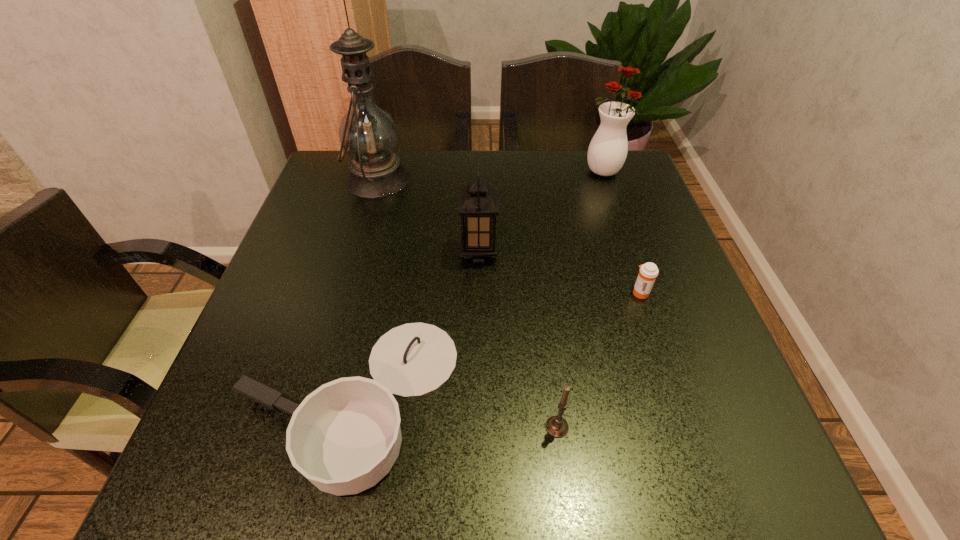
This screenshot has height=540, width=960. Identify the location of vacant space located on the back of the third object from right to left. (545, 335).

Locate an element on the screen. The width and height of the screenshot is (960, 540). vacant space located on the front of the fourth farthest object is located at coordinates (698, 462).

You are a GUI agent. You are given a task and a screenshot of the screen. Output one action in this format:
    pyautogui.click(x=<x>, y=<y>)
    Task: Click on the vacant space located 0.110m on the right of the saucepan
    
    Given the screenshot: What is the action you would take?
    pyautogui.click(x=517, y=399)

Image resolution: width=960 pixels, height=540 pixels. Find the location of `oil lamp located in the far edge section of the desktop`. oil lamp located in the far edge section of the desktop is located at coordinates (368, 134).

The height and width of the screenshot is (540, 960). I want to click on vase located at the far edge, so click(x=607, y=152).

The height and width of the screenshot is (540, 960). In order to click on object that is at the near edge in this screenshot , I will do `click(345, 436)`.

Find the location of `oil lamp that is at the left edge`. oil lamp that is at the left edge is located at coordinates (368, 134).

The height and width of the screenshot is (540, 960). Identify the location of saucepan located in the left edge section of the desktop. (345, 436).

Locate an element on the screen. The height and width of the screenshot is (540, 960). vase at the right edge is located at coordinates (607, 152).

Identify the location of medicine that is positioned at the right edge. (648, 272).